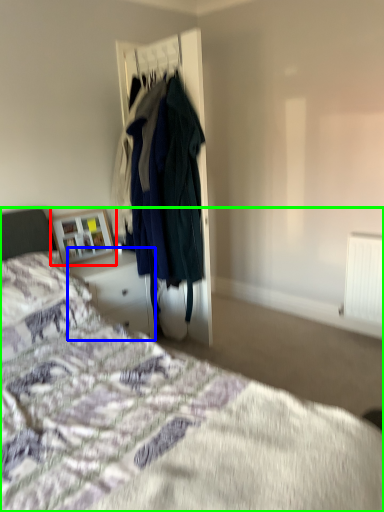
Question: Considering the real-world distances, which object is closest to picture frame (highlighted by a red box)? vanity (highlighted by a blue box) or bed (highlighted by a green box).

Choices:
 (A) vanity
 (B) bed

Answer: (A)